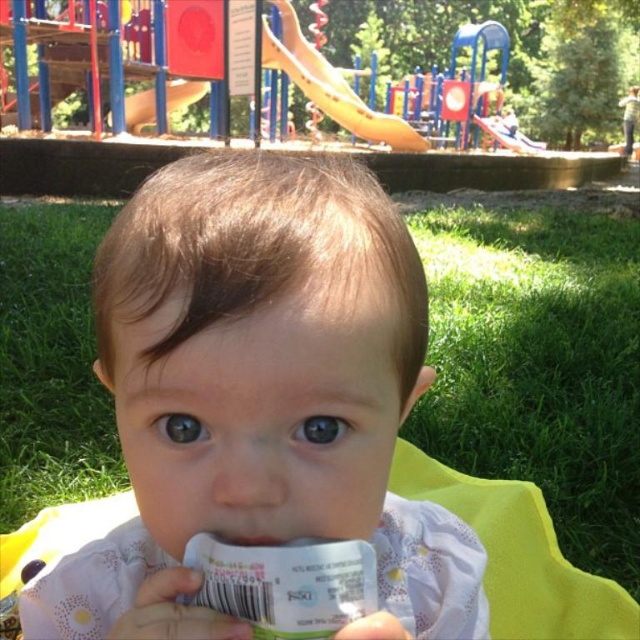
Is yellow plastic slide at upper center above white matte pacifier at center?

Yes.

Between point (288, 29) and point (237, 534), which one is positioned behind?

Positioned behind is point (288, 29).

Find the location of `yellow plastic slide at upper center`. yellow plastic slide at upper center is located at coordinates (330, 86).

Consider the image. Who is positioned more to the right, light pink fabric at center or white matte pacifier at center?

white matte pacifier at center is more to the right.

Does light pink fabric at center lie in front of white matte pacifier at center?

Yes, light pink fabric at center is closer to the viewer.

Is point (298, 323) closer to camera compared to point (227, 538)?

That is True.

Locate an element on the screen. light pink fabric at center is located at coordinates pyautogui.click(x=260, y=396).

Between point (300, 493) and point (332, 104), which one is positioned in front?

Point (300, 493)

Where is `light pink fabric at center`? light pink fabric at center is located at coordinates (260, 396).